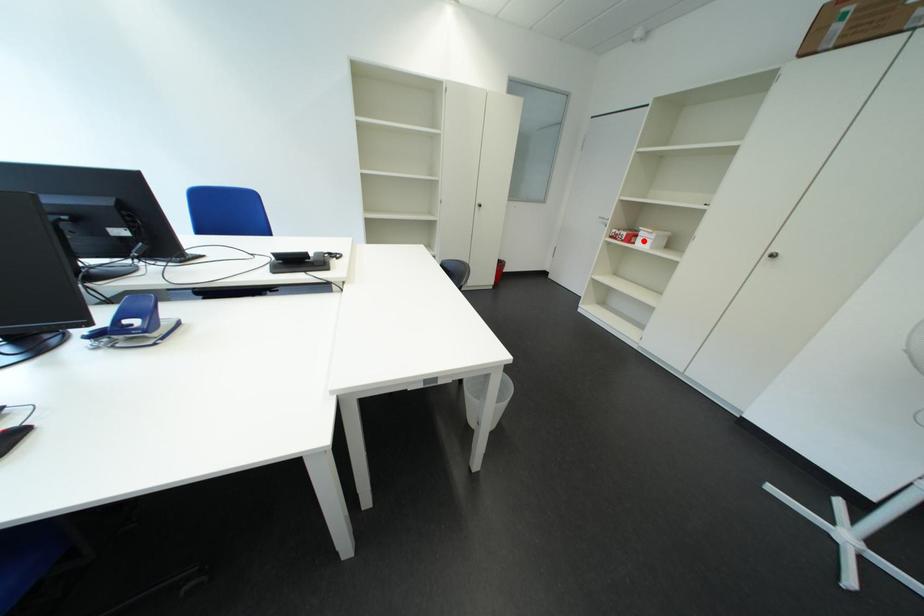
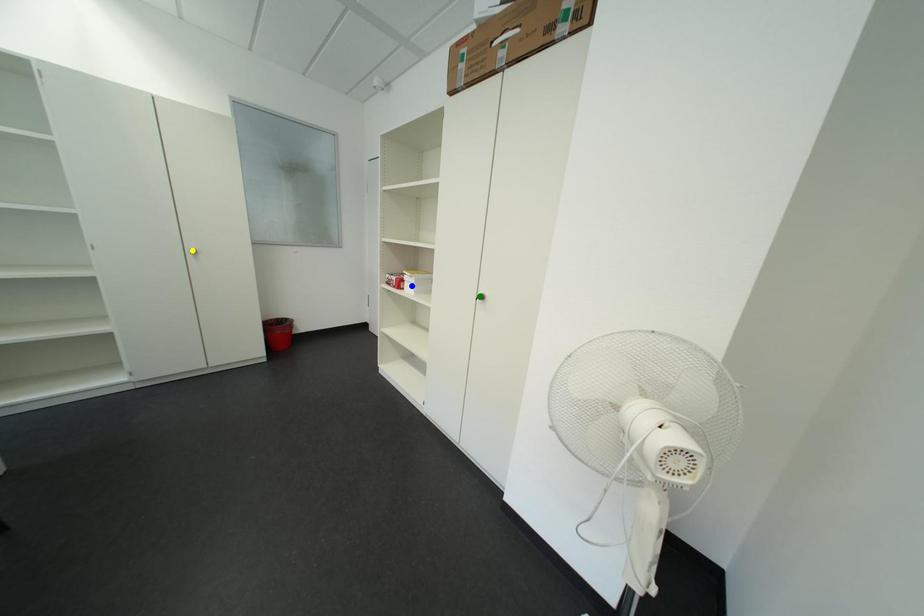
Question: I am providing you with two images of the same scene from different viewpoints. A red point is marked on the first image. You are given multiple points on the second image. Can you choose the point in image 2 that corresponds to the point in image 1?

Choices:
 (A) yellow point
 (B) green point
 (C) blue point

Answer: (C)